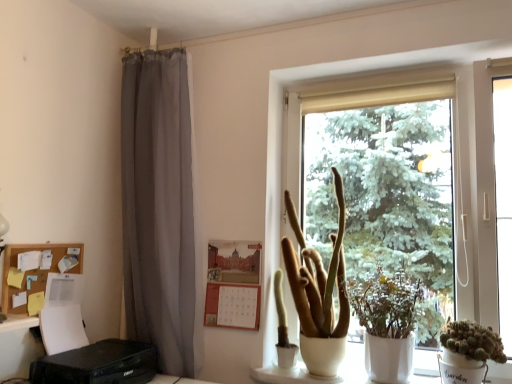
Measure the distance between white matte cactus at right, which is the first houseplant from right to left, and camera.

white matte cactus at right, which is the first houseplant from right to left, and camera are 5.46 feet apart.

Describe the element at coordinates (35, 270) in the screenshot. I see `corkboard paper at left` at that location.

What do you see at coordinates (283, 328) in the screenshot?
I see `green matte cactus at center` at bounding box center [283, 328].

Find the location of a particular element. green matte plant at center, the 2th houseplant in the right-to-left sequence is located at coordinates (387, 323).

From the picture: In terms of width, does white matte cactus at right, which is the first houseplant from right to left, look wider or thinner when compared to corkboard paper at left?

white matte cactus at right, which is the first houseplant from right to left, is wider than corkboard paper at left.

Is white matte cactus at right, which ranks as the third houseplant in left-to-right order, touching corkboard paper at left?

No, white matte cactus at right, which ranks as the third houseplant in left-to-right order, is not in contact with corkboard paper at left.

How different are the orientations of white matte cactus at right, which ranks as the third houseplant in left-to-right order, and corkboard paper at left in degrees?

The angle between the facing direction of white matte cactus at right, which ranks as the third houseplant in left-to-right order, and the facing direction of corkboard paper at left is 91.4 degrees.

Is white matte cactus at right, which ranks as the third houseplant in left-to-right order, inside or outside of corkboard paper at left?

white matte cactus at right, which ranks as the third houseplant in left-to-right order, lies outside corkboard paper at left.

Would you say white matte window at center is to the left or to the right of corkboard paper at left in the picture?

In the image, white matte window at center appears on the right side of corkboard paper at left.

What's the angular difference between white matte window at center and corkboard paper at left's facing directions?

The angle between the facing direction of white matte window at center and the facing direction of corkboard paper at left is 88.6 degrees.

From a real-world perspective, between white matte window at center and corkboard paper at left, who is vertically higher?

white matte window at center is physically above.

From the picture: From the image's perspective, relative to corkboard paper at left, is white matte window at center above or below?

Based on their image positions, white matte window at center is located above corkboard paper at left.

What's the angular difference between corkboard paper at left and green matte cactus at center's facing directions?

89.5 degrees.

Where is `shelf lying on the left of green matte cactus at center`? This screenshot has height=384, width=512. shelf lying on the left of green matte cactus at center is located at coordinates (35, 270).

Which of these two, corkboard paper at left or green matte cactus at center, stands taller?

green matte cactus at center.

Can you confirm if corkboard paper at left is bigger than green matte cactus at center?

Actually, corkboard paper at left might be smaller than green matte cactus at center.

Is point (462, 208) closer to viewer compared to point (393, 284)?

No, it is not.

Is green matte plant at center, the second houseplant viewed from the left, a part of white matte window at center?

Yes, green matte plant at center, the second houseplant viewed from the left, is surrounded by white matte window at center.

Based on the photo, is white matte window at center behind green matte plant at center, the 2th houseplant in the right-to-left sequence?

Yes.

Based on the photo, from the image's perspective, which is above, matte white pot at center, which is counted as the third houseplant, starting from the right, or corkboard paper at left?

matte white pot at center, which is counted as the third houseplant, starting from the right, is shown above in the image.

Does matte white pot at center, the first houseplant in the left-to-right sequence, have a greater height compared to corkboard paper at left?

Indeed, matte white pot at center, the first houseplant in the left-to-right sequence, has a greater height compared to corkboard paper at left.

Is matte white pot at center, the first houseplant in the left-to-right sequence, positioned beyond the bounds of corkboard paper at left?

Absolutely, matte white pot at center, the first houseplant in the left-to-right sequence, is external to corkboard paper at left.

Can you confirm if white matte cactus at right, which ranks as the third houseplant in left-to-right order, is smaller than white matte window at center?

Correct, white matte cactus at right, which ranks as the third houseplant in left-to-right order, occupies less space than white matte window at center.

From the image's perspective, which one is positioned higher, white matte cactus at right, which ranks as the third houseplant in left-to-right order, or white matte window at center?

white matte window at center.

Is white matte cactus at right, which ranks as the third houseplant in left-to-right order, thinner than white matte window at center?

Yes.

From their relative heights in the image, would you say white matte cactus at right, which is the first houseplant from right to left, is taller or shorter than white matte window at center?

In the image, white matte cactus at right, which is the first houseplant from right to left, appears to be shorter than white matte window at center.

Can you confirm if green matte plant at center, the 2th houseplant in the right-to-left sequence, is smaller than green matte cactus at center?

Actually, green matte plant at center, the 2th houseplant in the right-to-left sequence, might be larger than green matte cactus at center.

Consider the image. Can you confirm if green matte plant at center, the second houseplant viewed from the left, is taller than green matte cactus at center?

Indeed, green matte plant at center, the second houseplant viewed from the left, has a greater height compared to green matte cactus at center.

Is green matte plant at center, the 2th houseplant in the right-to-left sequence, completely or partially outside of green matte cactus at center?

Yes, green matte plant at center, the 2th houseplant in the right-to-left sequence, is outside of green matte cactus at center.

Is green matte plant at center, the 2th houseplant in the right-to-left sequence, to the right of green matte cactus at center from the viewer's perspective?

Yes.

Which houseplant is the 3rd one when counting from the front of the corkboard paper at left? Please provide its 2D coordinates.

[(468, 352)]

I want to click on window above the corkboard paper at left (from a real-world perspective), so click(346, 107).

From the image, which object appears to be farther from white matte cactus at right, which ranks as the third houseplant in left-to-right order, green matte cactus at center or white matte window at center?

white matte window at center lies further to white matte cactus at right, which ranks as the third houseplant in left-to-right order, than the other object.

Based on their spatial positions, is green matte plant at center, the second houseplant viewed from the left, or green matte cactus at center further from corkboard paper at left?

green matte plant at center, the second houseplant viewed from the left, is further to corkboard paper at left.

Based on their spatial positions, is matte white pot at center, which is counted as the third houseplant, starting from the right, or green matte plant at center, the 2th houseplant in the right-to-left sequence, closer to white matte window at center?

Among the two, matte white pot at center, which is counted as the third houseplant, starting from the right, is located nearer to white matte window at center.

Considering their positions, is white matte cactus at right, which ranks as the third houseplant in left-to-right order, positioned closer to white matte window at center than matte white pot at center, the first houseplant in the left-to-right sequence?

matte white pot at center, the first houseplant in the left-to-right sequence, is closer to white matte window at center.

Which object lies nearer to the anchor point white matte cactus at right, which ranks as the third houseplant in left-to-right order, matte white pot at center, which is counted as the third houseplant, starting from the right, or white matte window at center?

Among the two, matte white pot at center, which is counted as the third houseplant, starting from the right, is located nearer to white matte cactus at right, which ranks as the third houseplant in left-to-right order.

Looking at the image, which one is located closer to green matte plant at center, the 2th houseplant in the right-to-left sequence, corkboard paper at left or green matte cactus at center?

green matte cactus at center lies closer to green matte plant at center, the 2th houseplant in the right-to-left sequence, than the other object.

Looking at this image, based on their spatial positions, is green matte cactus at center or corkboard paper at left closer to green matte plant at center, the 2th houseplant in the right-to-left sequence?

The object closer to green matte plant at center, the 2th houseplant in the right-to-left sequence, is green matte cactus at center.

Based on their spatial positions, is white matte window at center or white matte cactus at right, which ranks as the third houseplant in left-to-right order, closer to green matte plant at center, the 2th houseplant in the right-to-left sequence?

white matte cactus at right, which ranks as the third houseplant in left-to-right order, is positioned closer to the anchor green matte plant at center, the 2th houseplant in the right-to-left sequence.

Find the location of a particular element. The width and height of the screenshot is (512, 384). houseplant between green matte cactus at center and green matte plant at center, the second houseplant viewed from the left, in the horizontal direction is located at coordinates (319, 293).

The height and width of the screenshot is (384, 512). I want to click on houseplant situated between matte white pot at center, the first houseplant in the left-to-right sequence, and white matte cactus at right, which is the first houseplant from right to left, from left to right, so [387, 323].

Find the location of a particular element. plant between corkboard paper at left and white matte cactus at right, which ranks as the third houseplant in left-to-right order, from left to right is located at coordinates (283, 328).

Where is `window between green matte cactus at center and white matte cactus at right, which is the first houseplant from right to left, from left to right`? Image resolution: width=512 pixels, height=384 pixels. window between green matte cactus at center and white matte cactus at right, which is the first houseplant from right to left, from left to right is located at coordinates (346, 107).